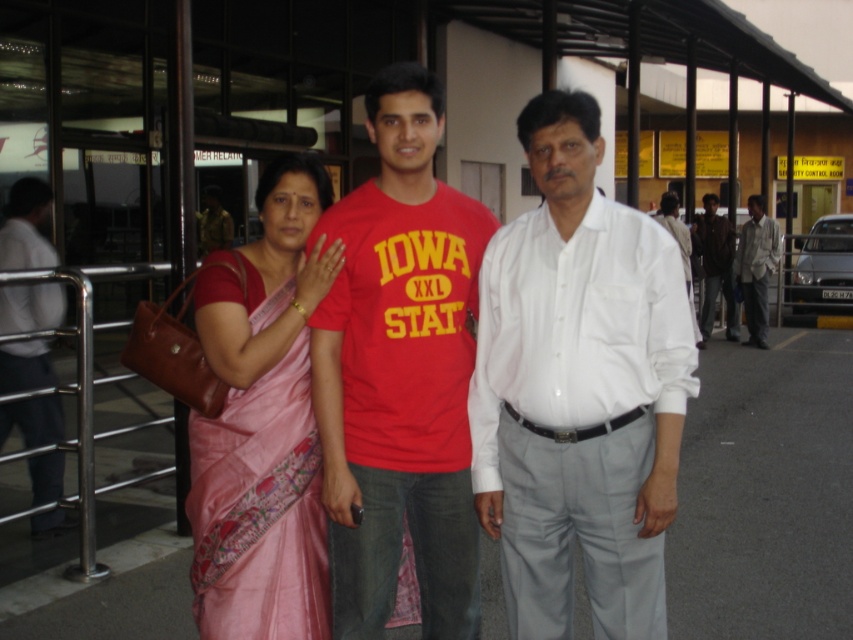
Does point (16, 221) lie in front of point (762, 243)?

That is True.

Does white shirt at left have a lesser height compared to white cotton shirt at right?

No, white shirt at left is not shorter than white cotton shirt at right.

In order to click on white shirt at left in this screenshot , I will do `click(26, 227)`.

Is point (572, 109) positioned before point (300, 548)?

Yes, point (572, 109) is closer to viewer.

Does white cotton shirt at center appear over pink silk saree at center?

Indeed, white cotton shirt at center is positioned over pink silk saree at center.

The image size is (853, 640). What do you see at coordinates (578, 388) in the screenshot?
I see `white cotton shirt at center` at bounding box center [578, 388].

The image size is (853, 640). I want to click on white cotton shirt at center, so click(x=578, y=388).

Between white cotton shirt at center and white shirt at left, which one appears on the left side from the viewer's perspective?

Positioned to the left is white shirt at left.

In the scene shown: Can you confirm if white cotton shirt at center is thinner than white shirt at left?

Correct, white cotton shirt at center's width is less than white shirt at left's.

Where is `white cotton shirt at center`? This screenshot has width=853, height=640. white cotton shirt at center is located at coordinates pyautogui.click(x=578, y=388).